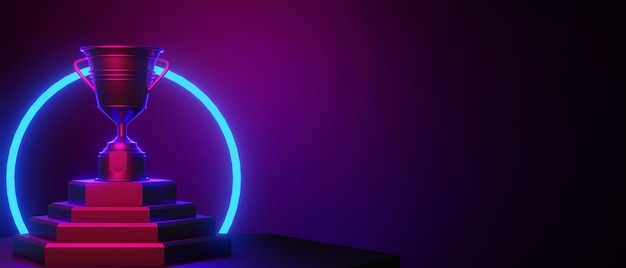
Find the location of a particular element. This screenshot has width=626, height=268. handle is located at coordinates (74, 61), (172, 62).